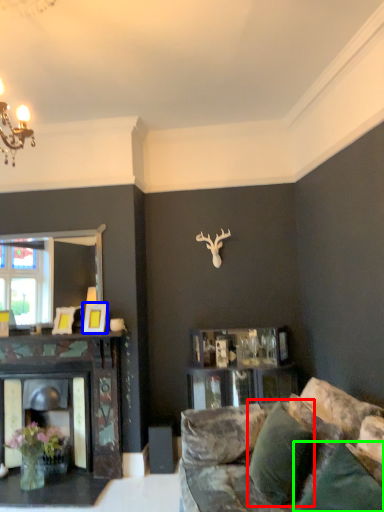
Question: Which is farther away from pillow (highlighted by a red box)? picture frame (highlighted by a blue box) or pillow (highlighted by a green box)?

Choices:
 (A) picture frame
 (B) pillow

Answer: (A)